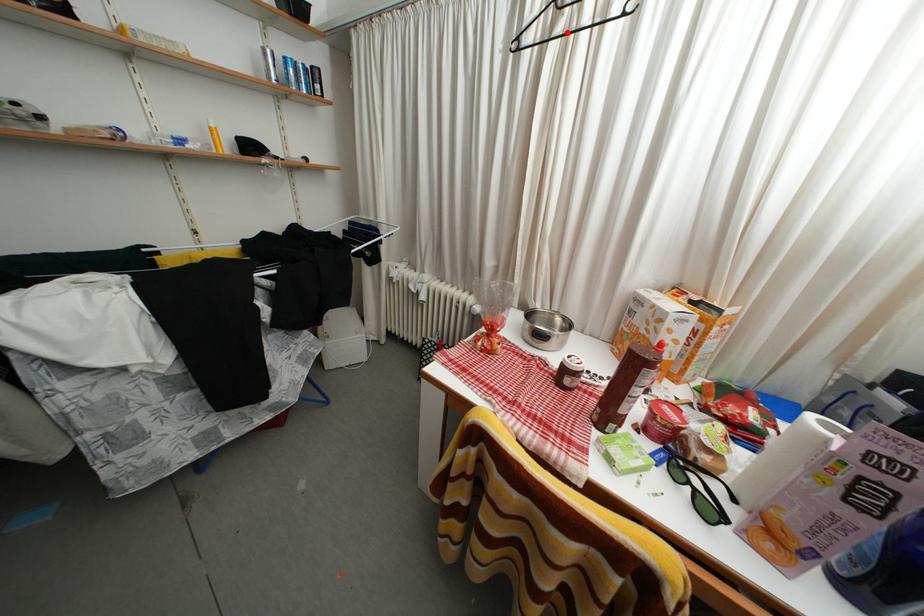
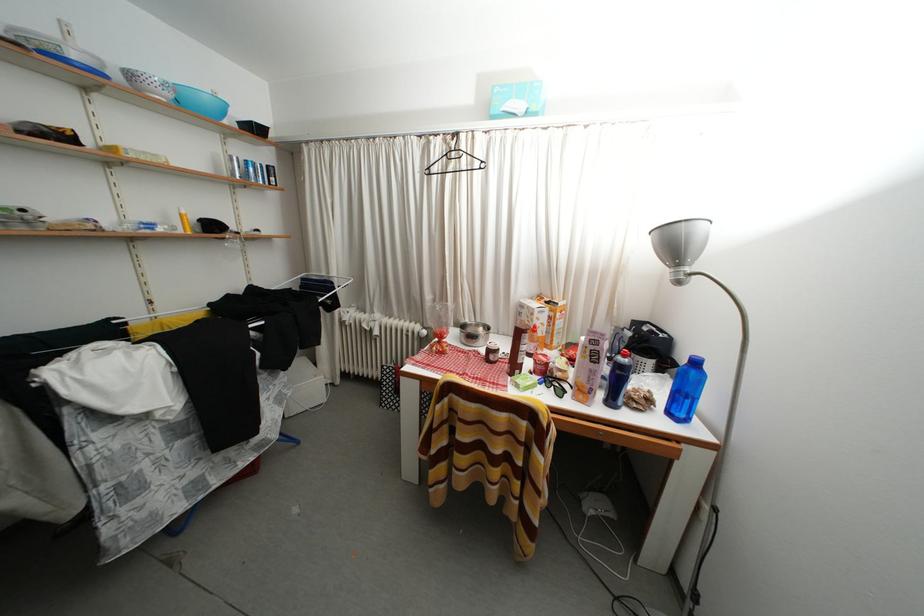
Question: I am providing you with two images of the same scene from different viewpoints. A red point is shown in image1. For the corresponding object point in image2, is it positioned nearer or farther from the camera?

Choices:
 (A) Nearer
 (B) Farther

Answer: (A)